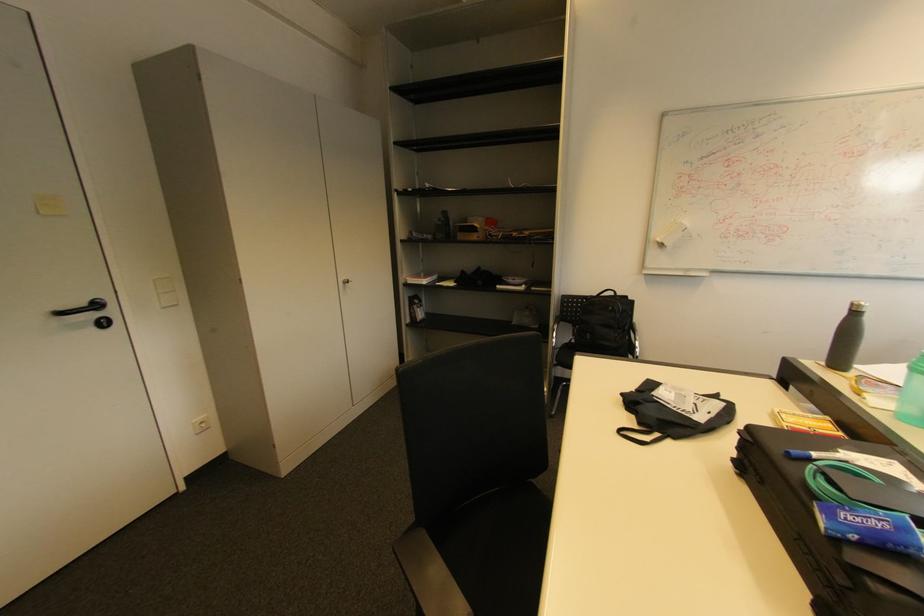
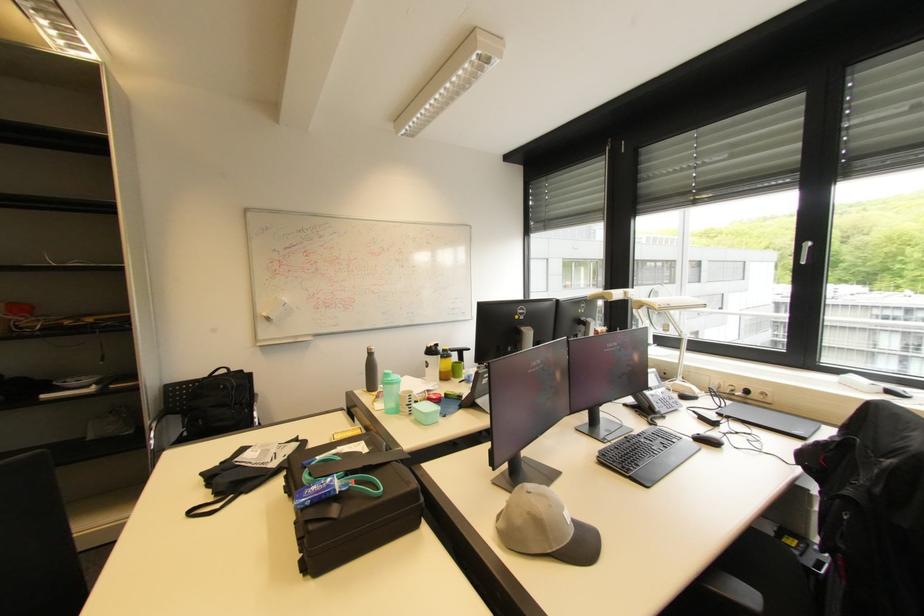
The point at [874,543] is marked in the first image. Where is the corresponding point in the second image?

(321, 501)